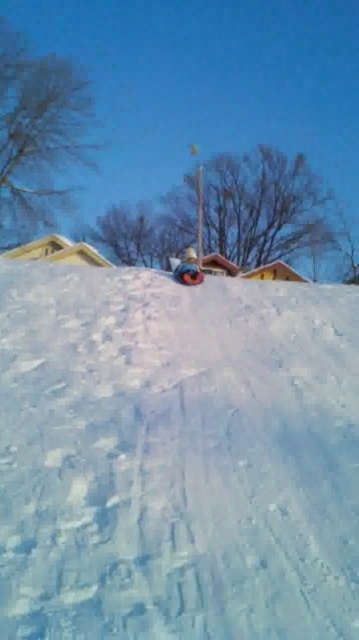
You are planning to build a snowman using the white powdery snow at center and the matte blue snowboard at center. Which object should you use as the base of the snowman?

The matte blue snowboard at center should be used as the base of the snowman because the white powdery snow at center is smaller than the matte blue snowboard at center, making the snowboard larger and more suitable for the base.

You are a snowboarder planning to ride down the slope where you see the white powdery snow at center and the matte blue snowboard at center. Which object would you encounter first as you go down the slope?

You would first encounter the white powdery snow at center because it is positioned in front of the matte blue snowboard at center along the slope.